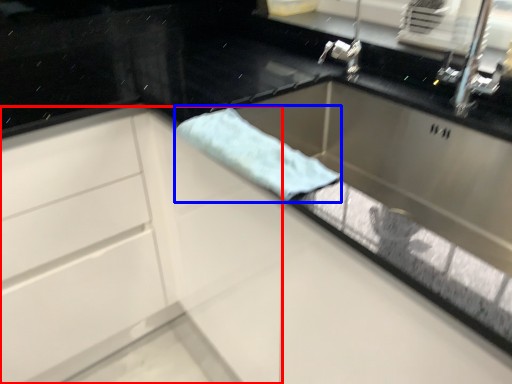
Question: Which of the following is the closest to the observer, cabinetry (highlighted by a red box) or beach towel (highlighted by a blue box)?

Choices:
 (A) cabinetry
 (B) beach towel

Answer: (B)